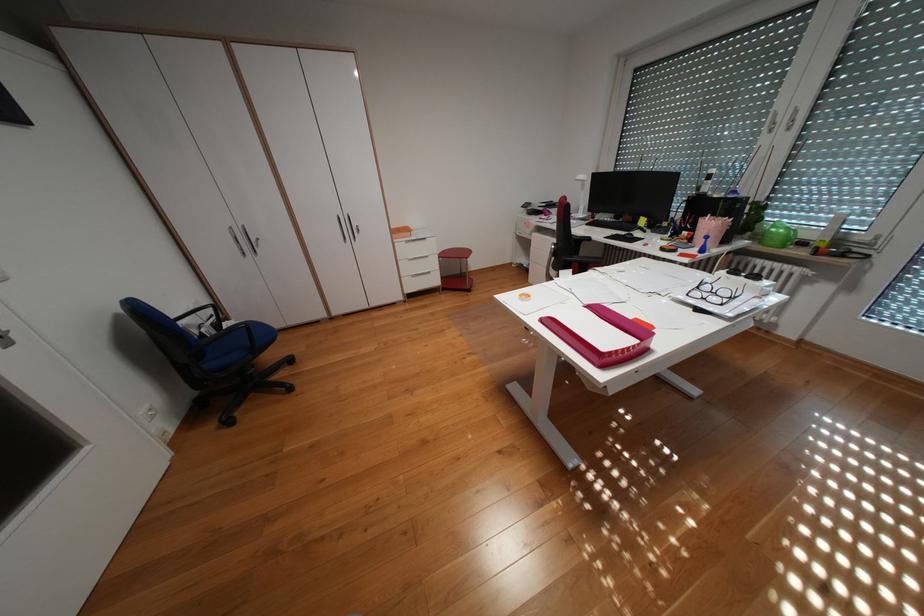
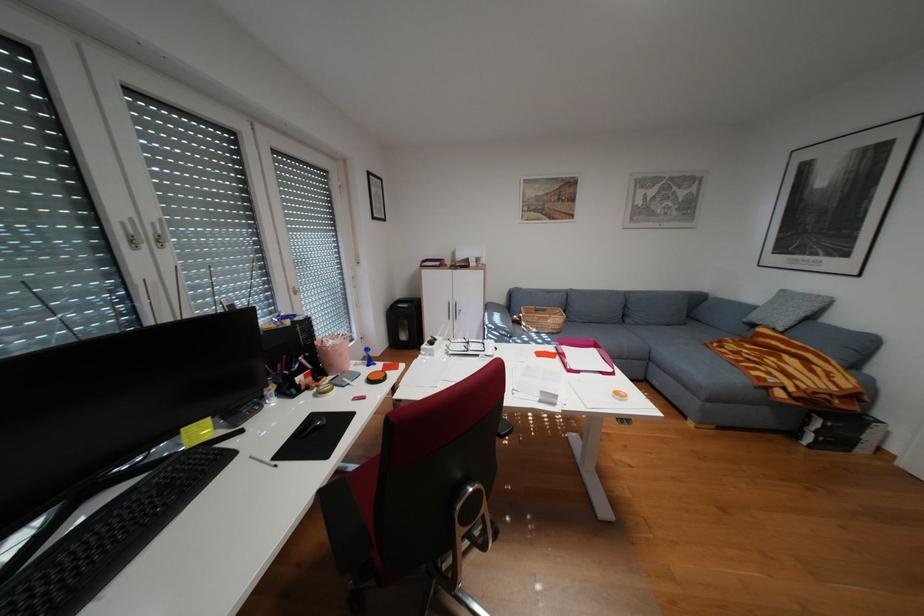
Find the pixel in the second image that matches (751,278) in the first image.

(448, 342)